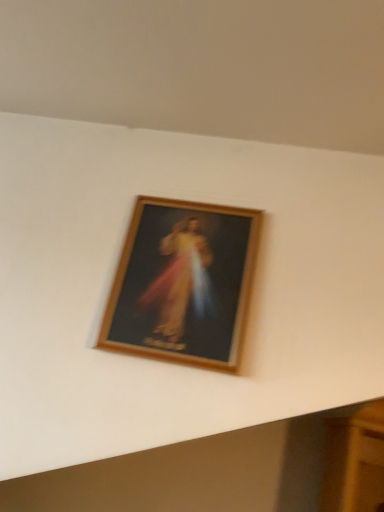
Question: Should I look upward or downward to see wooden picture frame at upper center?

Choices:
 (A) down
 (B) up

Answer: (A)